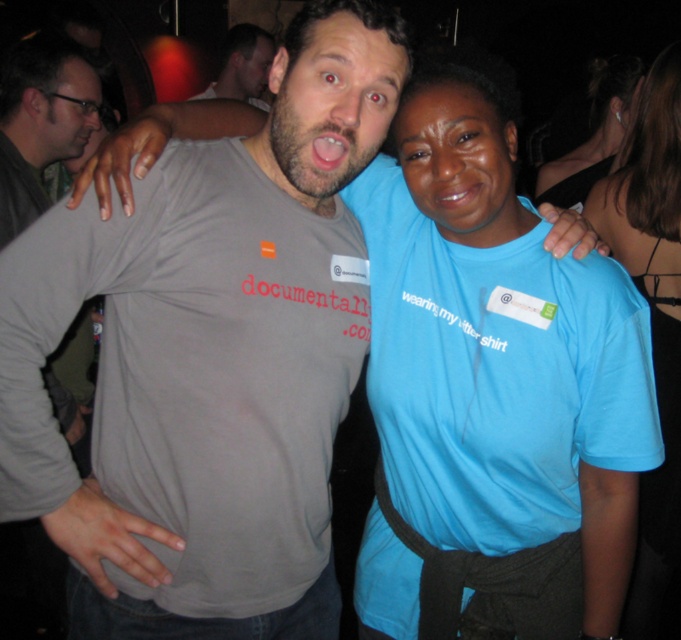
The image size is (681, 640). What do you see at coordinates (650, 310) in the screenshot? I see `blue cotton shirt at center` at bounding box center [650, 310].

Which is above, blue cotton shirt at center or gray matte t-shirt at left?

gray matte t-shirt at left is above.

Is point (667, 268) less distant than point (48, 38)?

Yes, it is in front of point (48, 38).

This screenshot has height=640, width=681. I want to click on blue cotton shirt at center, so click(x=650, y=310).

Does blue cotton shirt at center have a larger size compared to blue fabric shirt at upper center?

Incorrect, blue cotton shirt at center is not larger than blue fabric shirt at upper center.

Which is more to the right, blue cotton shirt at center or blue fabric shirt at upper center?

Positioned to the right is blue fabric shirt at upper center.

Who is more forward, (x=635, y=273) or (x=567, y=170)?

Point (x=635, y=273) is in front.

Image resolution: width=681 pixels, height=640 pixels. Find the location of `blue cotton shirt at center`. blue cotton shirt at center is located at coordinates (650, 310).

Which is behind, point (42, 204) or point (569, 202)?

Point (569, 202)

Can you confirm if gray matte t-shirt at left is thinner than blue fabric shirt at upper center?

Indeed, gray matte t-shirt at left has a lesser width compared to blue fabric shirt at upper center.

Is point (3, 106) closer to viewer compared to point (633, 76)?

Yes, it is.

Identify the location of gray matte t-shirt at left. (39, 122).